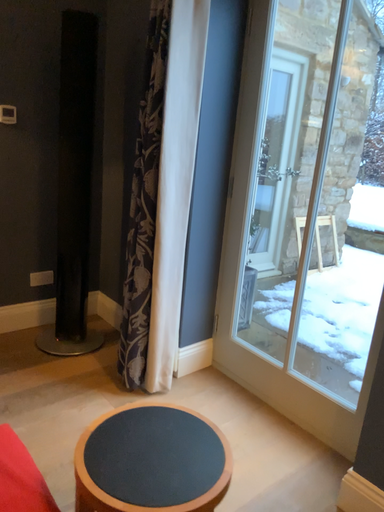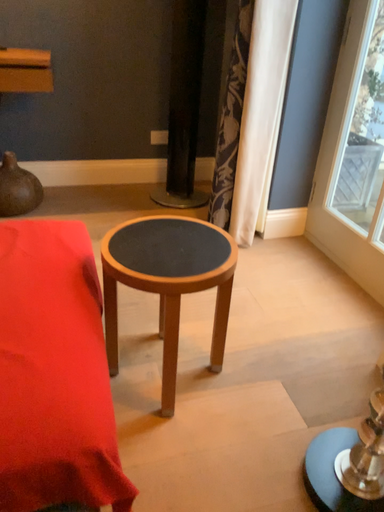
Question: How did the camera likely rotate when shooting the video?

Choices:
 (A) rotated downward
 (B) rotated upward

Answer: (A)